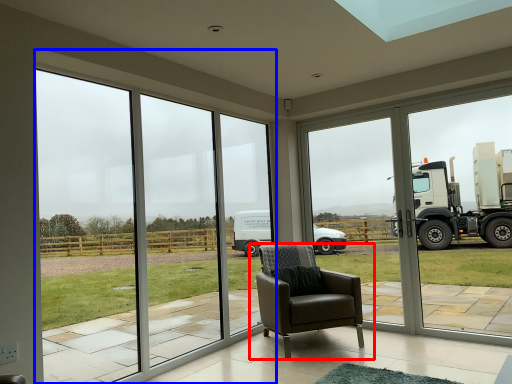
Question: Which object is closer to the camera taking this photo, chair (highlighted by a red box) or window (highlighted by a blue box)?

Choices:
 (A) chair
 (B) window

Answer: (B)